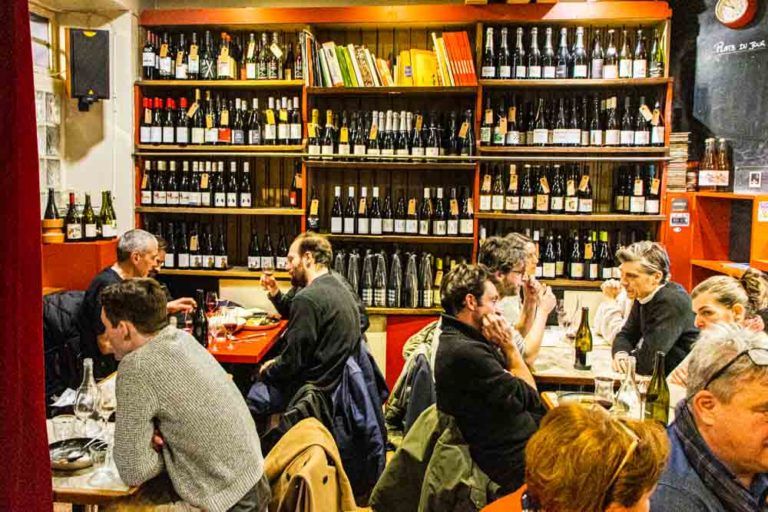
Locate an element on the screen. spoon is located at coordinates (77, 448).